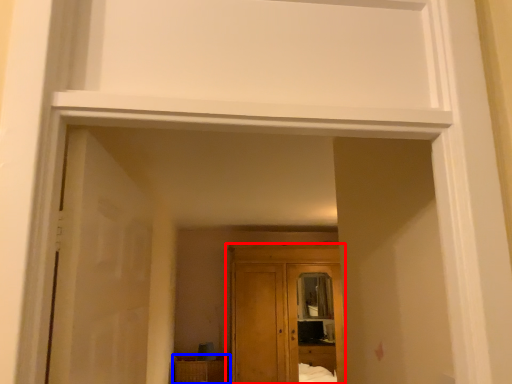
Question: Which object appears closest to the camera in this image, cupboard (highlighted by a red box) or cabinetry (highlighted by a blue box)?

Choices:
 (A) cupboard
 (B) cabinetry

Answer: (A)